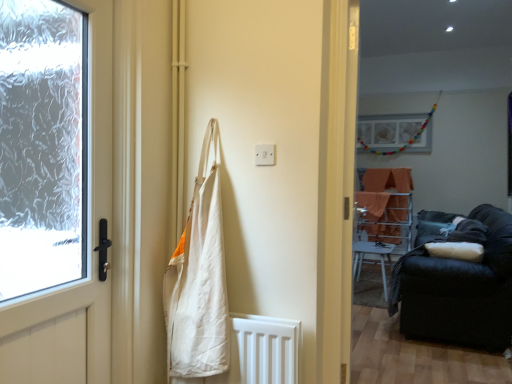
Measure the distance between point (410,233) and camera.

4.47 meters.

What do you see at coordinates (461, 290) in the screenshot?
I see `velvet dark blue couch at right` at bounding box center [461, 290].

Find the location of a particular element. This screenshot has width=512, height=384. orange fabric at center is located at coordinates [386, 203].

In the image, is white plastic chair at center positioned in front of or behind orange fabric at center?

Clearly, white plastic chair at center is in front of orange fabric at center.

Considering the relative sizes of white plastic chair at center and orange fabric at center in the image provided, is white plastic chair at center bigger than orange fabric at center?

No, white plastic chair at center is not bigger than orange fabric at center.

Is white plastic chair at center to the left or to the right of orange fabric at center in the image?

white plastic chair at center is positioned on orange fabric at center's left side.

Which object is wider, matte white door at left or white canvas bag at center?

white canvas bag at center.

In the image, is matte white door at left positioned in front of or behind white canvas bag at center?

In the image, matte white door at left appears in front of white canvas bag at center.

Could you tell me if matte white door at left is facing white canvas bag at center?

No.

Who is shorter, matte white door at left or white plastic chair at center?

white plastic chair at center is shorter.

Is point (37, 381) in front of point (354, 260)?

Yes.

Is matte white door at left inside or outside of white plastic chair at center?

matte white door at left cannot be found inside white plastic chair at center.

Which of these two, matte white door at left or white plastic chair at center, is wider?

white plastic chair at center is wider.

Which of these two, orange fabric at center or white canvas bag at center, stands taller?

Standing taller between the two is white canvas bag at center.

Is orange fabric at center further to the viewer compared to white canvas bag at center?

Yes, orange fabric at center is further from the camera.

From the image's perspective, between orange fabric at center and white canvas bag at center, which one is located above?

orange fabric at center is shown above in the image.

From a real-world perspective, is orange fabric at center over white canvas bag at center?

No, from a real-world perspective, orange fabric at center is not above white canvas bag at center.

Locate an element on the screen. The image size is (512, 384). door that is above the orange fabric at center (from the image's perspective) is located at coordinates (88, 254).

Does orange fabric at center turn towards matte white door at left?

Yes.

Does point (388, 237) appear closer or farther from the camera than point (96, 202)?

Point (388, 237) is farther from the camera than point (96, 202).

Is orange fabric at center beside matte white door at left?

No, orange fabric at center is not touching matte white door at left.

Would you say black fabric couch at right is a long distance from velvet dark blue couch at right?

→ black fabric couch at right is far away from velvet dark blue couch at right.

Is black fabric couch at right wider or thinner than velvet dark blue couch at right?

In the image, black fabric couch at right appears to be more narrow than velvet dark blue couch at right.

Is black fabric couch at right positioned in front of velvet dark blue couch at right?

Yes, it is in front of velvet dark blue couch at right.

Who is taller, black fabric couch at right or velvet dark blue couch at right?

Standing taller between the two is black fabric couch at right.

From a real-world perspective, between black fabric couch at right and white plastic chair at center, who is vertically lower?

In real-world perspective, white plastic chair at center is lower.

Considering the relative positions of black fabric couch at right and white plastic chair at center in the image provided, is black fabric couch at right behind white plastic chair at center?

No.

Consider the image. Between black fabric couch at right and white plastic chair at center, which one appears on the right side from the viewer's perspective?

Positioned to the right is white plastic chair at center.

Is point (477, 18) closer to camera compared to point (383, 254)?

No, it is behind (383, 254).

The image size is (512, 384). Identify the location of blanket above the white plastic chair at center (from a real-world perspective). (386, 203).

This screenshot has height=384, width=512. In the image, there is a matte white door at left. Find the location of `shopping bag below it (from a real-world perspective)`. shopping bag below it (from a real-world perspective) is located at coordinates (199, 278).

Estimate the real-world distances between objects in this image. Which object is further from orange fabric at center, white canvas bag at center or velvet dark blue couch at right?

The object further to orange fabric at center is white canvas bag at center.

When comparing their distances from black fabric couch at right, does velvet dark blue couch at right or orange fabric at center seem closer?

The object closer to black fabric couch at right is orange fabric at center.

When comparing their distances from orange fabric at center, does velvet dark blue couch at right or white canvas bag at center seem closer?

velvet dark blue couch at right.

Considering their positions, is black fabric couch at right positioned closer to white plastic chair at center than velvet dark blue couch at right?

velvet dark blue couch at right is closer to white plastic chair at center.

Looking at the image, which one is located further to orange fabric at center, matte white door at left or black fabric couch at right?

matte white door at left is positioned further to the anchor orange fabric at center.

Looking at this image, which object lies nearer to the anchor point black fabric couch at right, velvet dark blue couch at right or matte white door at left?

velvet dark blue couch at right is positioned closer to the anchor black fabric couch at right.

From the image, which object appears to be farther from orange fabric at center, matte white door at left or velvet dark blue couch at right?

The object further to orange fabric at center is matte white door at left.

Based on their spatial positions, is white plastic chair at center or black fabric couch at right further from white canvas bag at center?

Among the two, black fabric couch at right is located further to white canvas bag at center.

You are a GUI agent. You are given a task and a screenshot of the screen. Output one action in this format:
    pyautogui.click(x=<x>, y=<y>)
    Task: Click on the furniture between black fabric couch at right and orange fabric at center from front to back
    
    Given the screenshot: What is the action you would take?
    pyautogui.click(x=376, y=260)

This screenshot has width=512, height=384. Find the location of `corridor between matte white door at left and velvet dark blue couch at right in the horizontal direction`. corridor between matte white door at left and velvet dark blue couch at right in the horizontal direction is located at coordinates (442, 94).

The height and width of the screenshot is (384, 512). What are the coordinates of `furniture between white canvas bag at center and orange fabric at center from front to back` in the screenshot? It's located at (376, 260).

Locate an element on the screen. The height and width of the screenshot is (384, 512). shopping bag between black fabric couch at right and white plastic chair at center in the front-back direction is located at coordinates (199, 278).